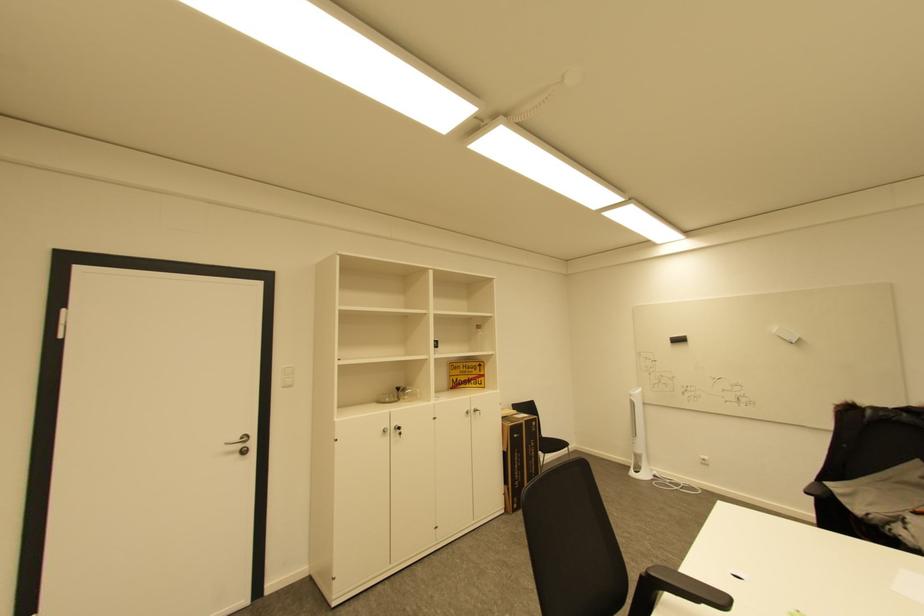
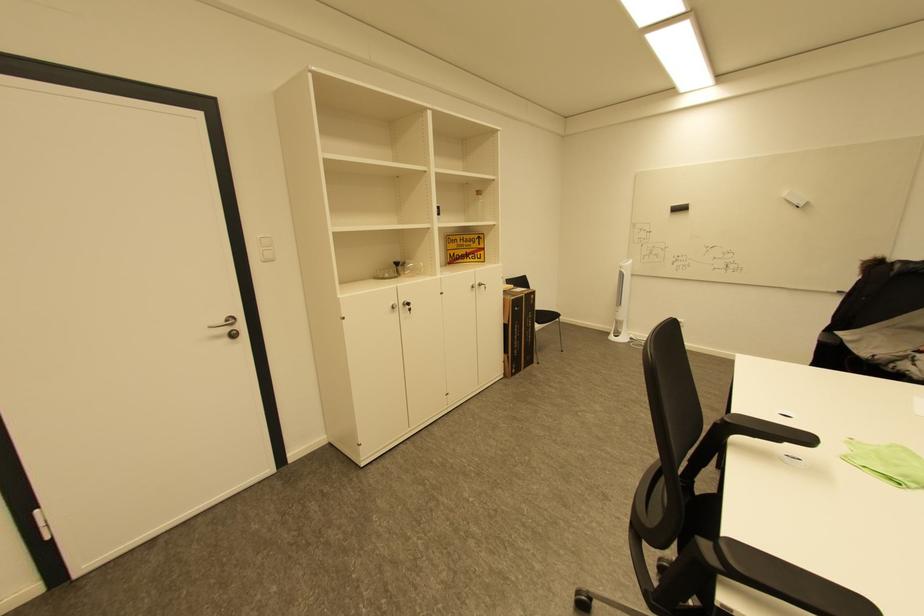
Locate, in the second image, the point that corresponds to (x=246, y=447) in the first image.

(233, 330)